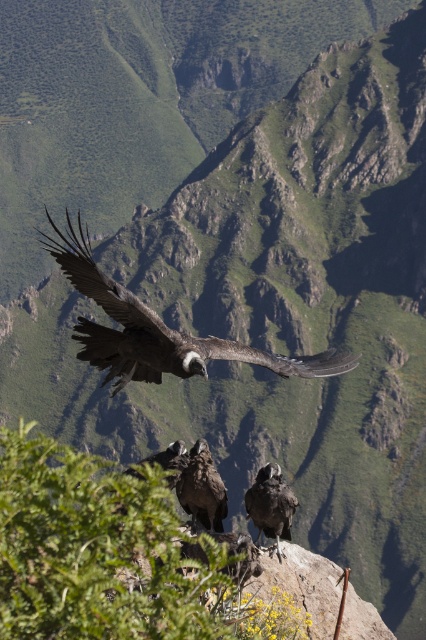
Question: Which point is closer to the camera?

Choices:
 (A) (178, 488)
 (B) (155, 630)
 (C) (270, 499)

Answer: (B)

Question: Considering the real-world distances, which object is farthest from the green leafy shrub at center?

Choices:
 (A) dark gray feathers at lower right
 (B) dark brown feathered eagle at center
 (C) dark brown feathers at center

Answer: (B)

Question: Considering the real-world distances, which object is farthest from the dark gray feathers at lower right?

Choices:
 (A) dark brown feathers at center
 (B) dark brown feathered eagle at center
 (C) green leafy shrub at center

Answer: (B)

Question: Does green leafy shrub at center appear under dark brown feathered eagle at center?

Choices:
 (A) yes
 (B) no

Answer: (A)

Question: Is dark brown feathered eagle at center further to camera compared to dark brown feathers at center?

Choices:
 (A) no
 (B) yes

Answer: (A)

Question: Where is green leafy shrub at center located in relation to dark brown feathers at center in the image?

Choices:
 (A) above
 (B) below

Answer: (B)